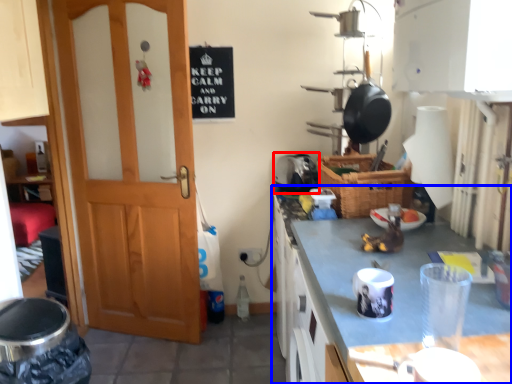
Question: Which point is further to the camera, appliance (highlighted by a red box) or cabinetry (highlighted by a blue box)?

Choices:
 (A) appliance
 (B) cabinetry

Answer: (A)